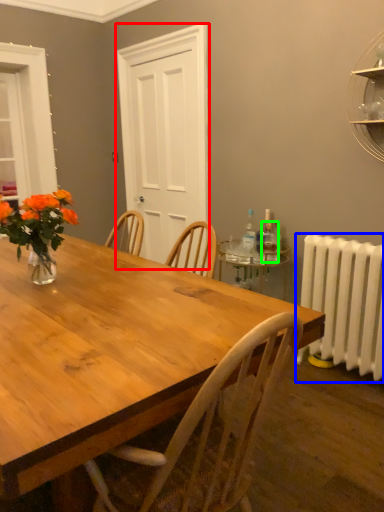
Question: Based on their relative distances, which object is nearer to glass door (highlighted by a red box)? Choose from radiator (highlighted by a blue box) and bottle (highlighted by a green box).

Choices:
 (A) radiator
 (B) bottle

Answer: (B)